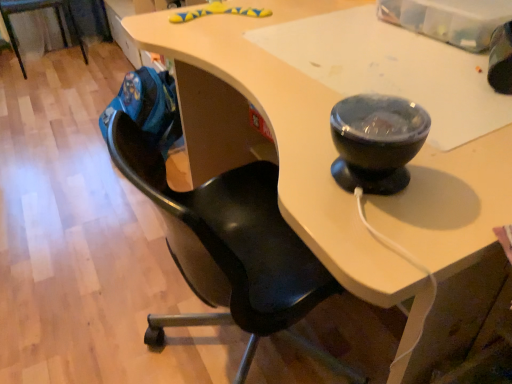
Identify the location of vacant space to the left of black matte chair at center, which is counted as the 2th chair, starting from the back. This screenshot has height=384, width=512. (89, 306).